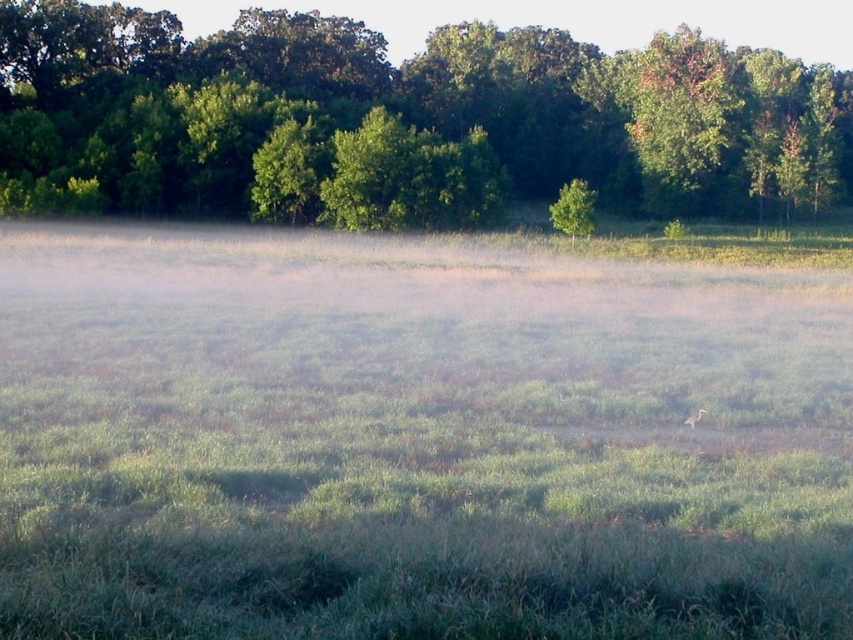
You are a photographer trying to capture the brown feathered bird at center in the image. The green grassy field at center is much taller than the bird. How might the height of the grass affect your ability to see the bird clearly?

The green grassy field at center is much taller than the brown feathered bird at center, which means the grass could obstruct the view of the bird, making it harder to see clearly.